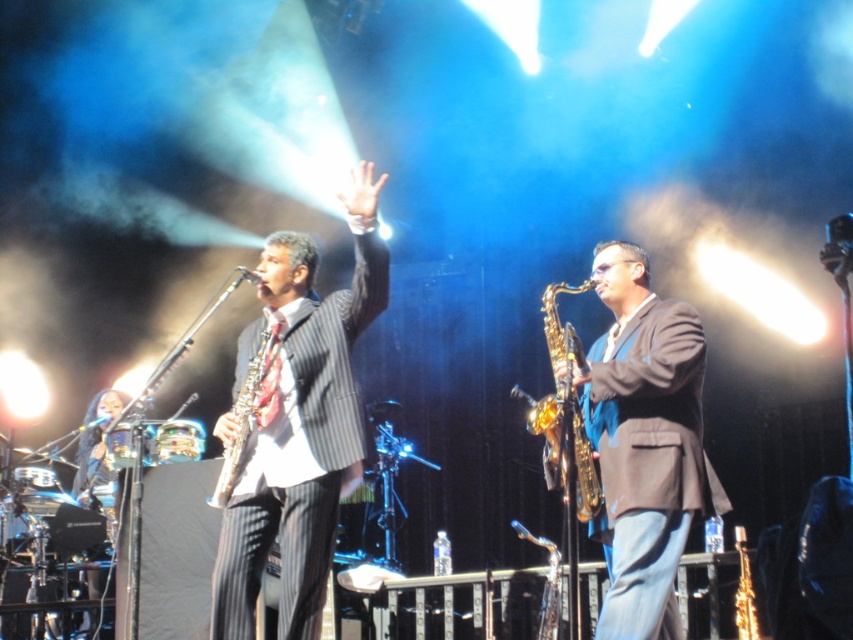
Question: Based on their relative distances, which object is farther from the pinstripe suit at center?

Choices:
 (A) silver metallic saxophone at center
 (B) gold shiny saxophone at center
 (C) shiny gold saxophone at center

Answer: (C)

Question: Is pinstripe suit at center positioned behind silver metallic saxophone at center?

Choices:
 (A) no
 (B) yes

Answer: (A)

Question: Estimate the real-world distances between objects in this image. Which object is closer to the gold shiny saxophone at center?

Choices:
 (A) pinstripe suit at center
 (B) silver metallic saxophone at center

Answer: (A)

Question: Where is pinstripe suit at center located in relation to shiny gold saxophone at center in the image?

Choices:
 (A) above
 (B) below

Answer: (A)

Question: Which point appears farthest from the camera in this image?

Choices:
 (A) (612, 256)
 (B) (554, 296)

Answer: (B)

Question: Is shiny gold saxophone at center smaller than silver metallic saxophone at center?

Choices:
 (A) yes
 (B) no

Answer: (B)